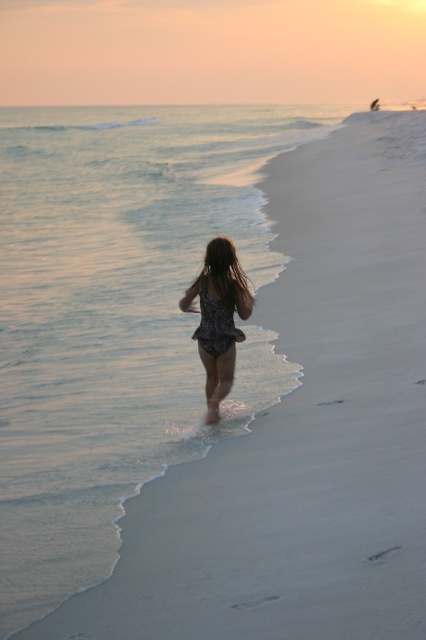
You are standing on the beach and see the clear water at lower left and the brown silky hair at center. Which object is closer to you?

The clear water at lower left is closer to you because it is positioned over the brown silky hair at center, indicating it is in front.

From the picture: You are standing at the center of the beach scene and want to find the clear water at lower left. According to the coordinates provided, in which direction should you walk to reach it?

The clear water at lower left is located at point (118,317), which means it is positioned slightly to the left and lower from the center. You should walk diagonally towards the lower left direction to reach it.